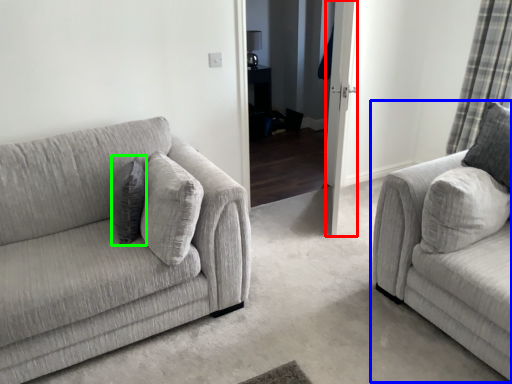
Question: Based on their relative distances, which object is farther from glass door (highlighted by a red box)? Choose from studio couch (highlighted by a blue box) and pillow (highlighted by a green box).

Choices:
 (A) studio couch
 (B) pillow

Answer: (B)